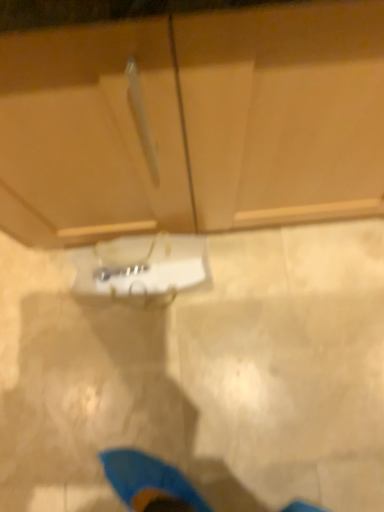
What are the coordinates of `white glossy sink at center` in the screenshot? It's located at (141, 269).

Image resolution: width=384 pixels, height=512 pixels. What do you see at coordinates (141, 269) in the screenshot? I see `white glossy sink at center` at bounding box center [141, 269].

This screenshot has width=384, height=512. What are the coordinates of `white glossy sink at center` in the screenshot? It's located at (141, 269).